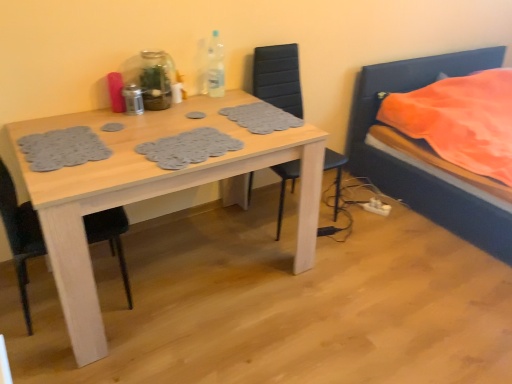
The width and height of the screenshot is (512, 384). Find the location of `unoccupied region to the right of white plastic power plugs and sockets at lower right`. unoccupied region to the right of white plastic power plugs and sockets at lower right is located at coordinates (405, 215).